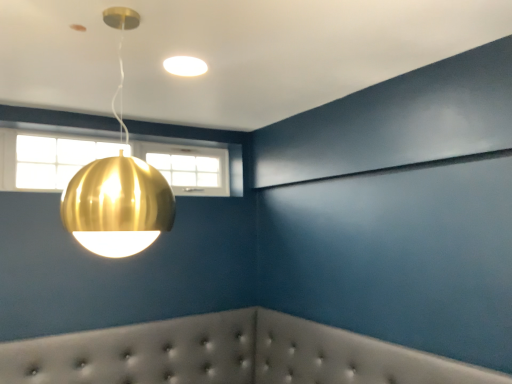
Question: Does matte white light fixture at upper center, the first lamp in the top-to-bottom sequence, come behind clear glass window at upper left?

Choices:
 (A) no
 (B) yes

Answer: (A)

Question: Does matte white light fixture at upper center, which is counted as the 1th lamp, starting from the back, have a greater height compared to clear glass window at upper left?

Choices:
 (A) no
 (B) yes

Answer: (A)

Question: From a real-world perspective, is matte white light fixture at upper center, the first lamp in the top-to-bottom sequence, physically above clear glass window at upper left?

Choices:
 (A) no
 (B) yes

Answer: (B)

Question: Considering the relative sizes of matte white light fixture at upper center, which ranks as the second lamp in front-to-back order, and clear glass window at upper left in the image provided, is matte white light fixture at upper center, which ranks as the second lamp in front-to-back order, shorter than clear glass window at upper left?

Choices:
 (A) no
 (B) yes

Answer: (B)

Question: Is clear glass window at upper left inside matte white light fixture at upper center, which is counted as the 1th lamp, starting from the back?

Choices:
 (A) yes
 (B) no

Answer: (B)

Question: Do you think matte white light fixture at upper center, which ranks as the second lamp in front-to-back order, is within clear glass window at upper left, or outside of it?

Choices:
 (A) inside
 (B) outside

Answer: (B)

Question: From the image's perspective, is matte white light fixture at upper center, which is counted as the 1th lamp, starting from the back, positioned above or below clear glass window at upper left?

Choices:
 (A) below
 (B) above

Answer: (B)

Question: Is point (192, 69) closer or farther from the camera than point (64, 140)?

Choices:
 (A) farther
 (B) closer

Answer: (B)

Question: In terms of width, does matte white light fixture at upper center, which ranks as the second lamp in front-to-back order, look wider or thinner when compared to clear glass window at upper left?

Choices:
 (A) wide
 (B) thin

Answer: (A)

Question: Considering the positions of clear glass window at upper left and white tufted headboard at lower center in the image, is clear glass window at upper left wider or thinner than white tufted headboard at lower center?

Choices:
 (A) thin
 (B) wide

Answer: (A)

Question: Does point (22, 142) appear closer or farther from the camera than point (1, 360)?

Choices:
 (A) farther
 (B) closer

Answer: (A)

Question: Choose the correct answer: Is clear glass window at upper left inside white tufted headboard at lower center or outside it?

Choices:
 (A) inside
 (B) outside

Answer: (B)

Question: From a real-world perspective, is clear glass window at upper left positioned above or below white tufted headboard at lower center?

Choices:
 (A) below
 (B) above

Answer: (B)

Question: Considering the positions of matte white light fixture at upper center, which ranks as the second lamp in front-to-back order, and white tufted headboard at lower center in the image, is matte white light fixture at upper center, which ranks as the second lamp in front-to-back order, bigger or smaller than white tufted headboard at lower center?

Choices:
 (A) small
 (B) big

Answer: (A)

Question: Looking at their shapes, would you say matte white light fixture at upper center, the first lamp in the top-to-bottom sequence, is wider or thinner than white tufted headboard at lower center?

Choices:
 (A) thin
 (B) wide

Answer: (A)